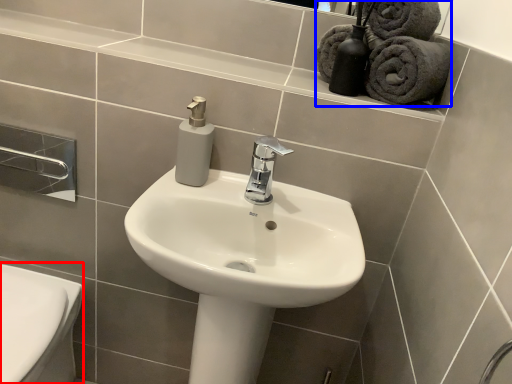
Question: Which object appears farthest to the camera in this image, bidet (highlighted by a red box) or bath towel (highlighted by a blue box)?

Choices:
 (A) bidet
 (B) bath towel

Answer: (A)